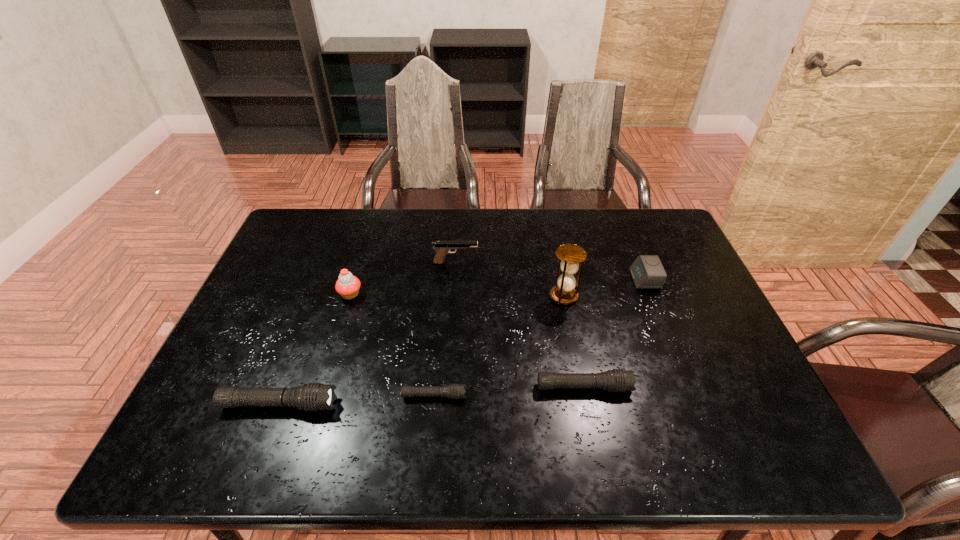
The image size is (960, 540). I want to click on free space located at the lens end of the shortest flashlight, so click(x=513, y=396).

Where is `vacant space situated 0.210m at the lens end of the second shortest object`? The height and width of the screenshot is (540, 960). vacant space situated 0.210m at the lens end of the second shortest object is located at coordinates (719, 387).

At what (x,y) coordinates should I click in order to perform the action: click on vacant space located 0.250m at the muzzle of the farthest object. Please return your answer as a coordinate pair (x, y). This screenshot has width=960, height=540. Looking at the image, I should click on click(x=558, y=262).

Where is `vacant space positioned 0.270m on the front-facing side of the rightmost object`? The width and height of the screenshot is (960, 540). vacant space positioned 0.270m on the front-facing side of the rightmost object is located at coordinates (542, 279).

Find the location of a particular element. The height and width of the screenshot is (540, 960). vacant region located on the front-facing side of the rightmost object is located at coordinates pyautogui.click(x=572, y=279).

At what (x,y) coordinates should I click in order to perform the action: click on vacant space located 0.270m on the front-facing side of the rightmost object. Please return your answer as a coordinate pair (x, y). This screenshot has width=960, height=540. Looking at the image, I should click on (542, 279).

Identify the location of vacant space located on the front of the cupcake. This screenshot has height=540, width=960. pos(342,322).

The image size is (960, 540). Identify the location of vacant space situated 0.220m on the front of the hourglass. tap(579, 372).

Where is `object situated at the left edge`? The image size is (960, 540). object situated at the left edge is located at coordinates (313, 396).

This screenshot has height=540, width=960. Identify the location of object positioned at the right edge. (647, 272).